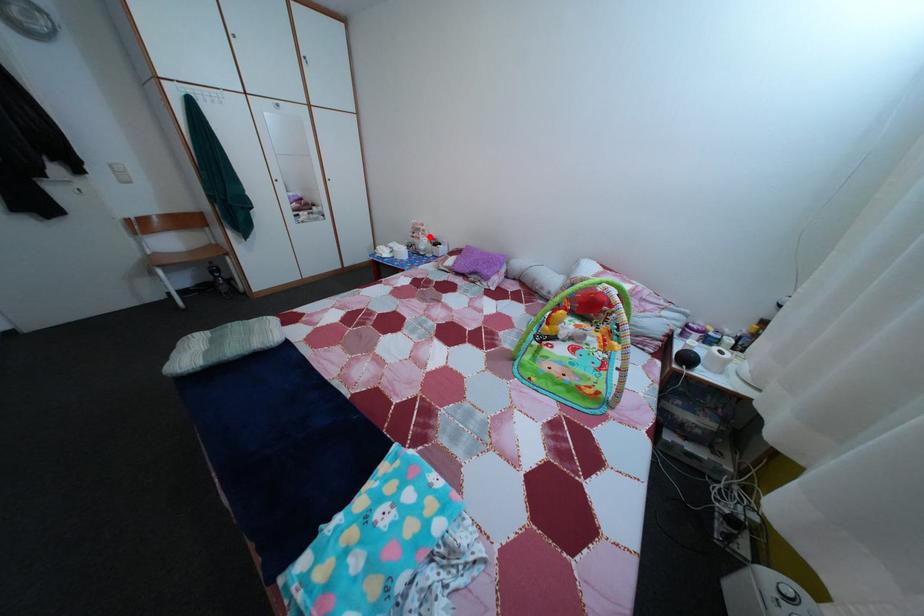
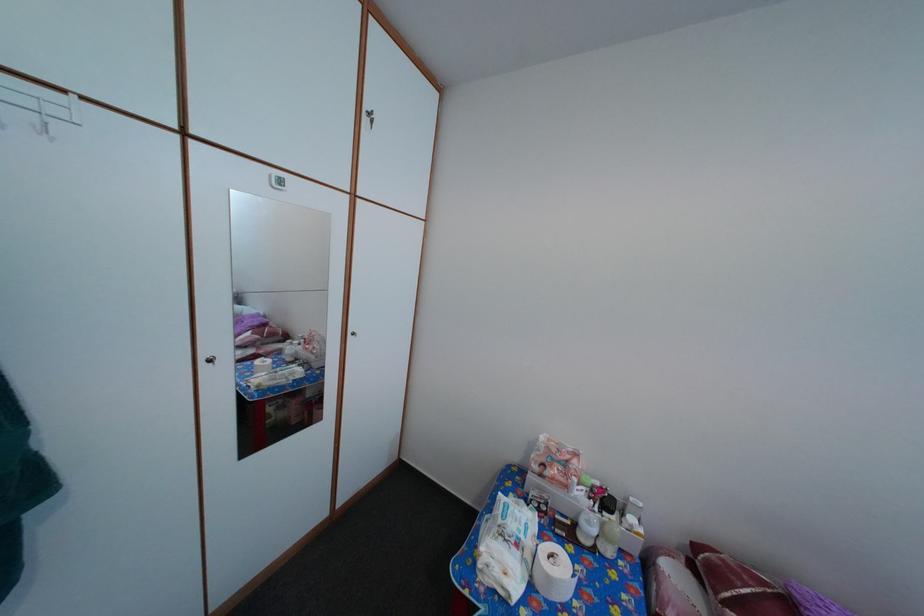
Find the pixel in the second image that matches the highlighted location in the first image.

(576, 469)